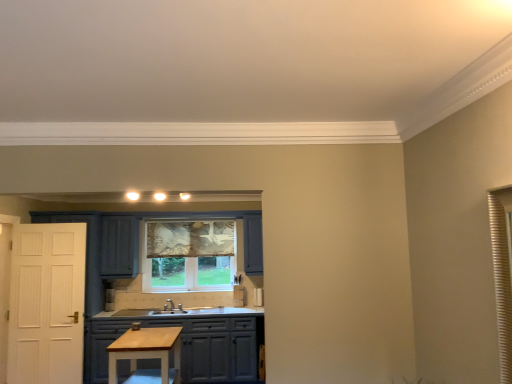
Question: Is light wood table at center situated inside patterned fabric window at center or outside?

Choices:
 (A) inside
 (B) outside

Answer: (B)

Question: Looking at their shapes, would you say light wood table at center is wider or thinner than patterned fabric window at center?

Choices:
 (A) wide
 (B) thin

Answer: (A)

Question: Estimate the real-world distances between objects in this image. Which object is closer to the matte gray cabinets at center?

Choices:
 (A) patterned fabric window at center
 (B) light wood table at center

Answer: (B)

Question: Estimate the real-world distances between objects in this image. Which object is closer to the light wood table at center?

Choices:
 (A) matte gray cabinets at center
 (B) patterned fabric window at center

Answer: (A)